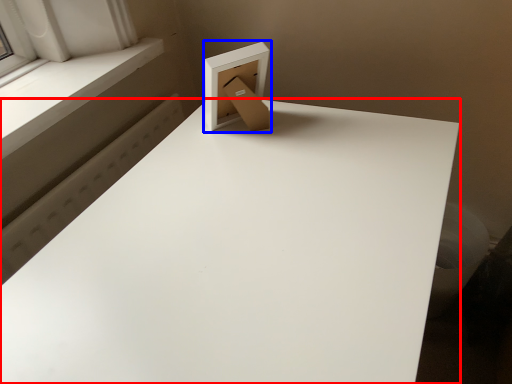
Question: Among these objects, which one is nearest to the camera, table (highlighted by a red box) or cardboard box (highlighted by a blue box)?

Choices:
 (A) table
 (B) cardboard box

Answer: (A)